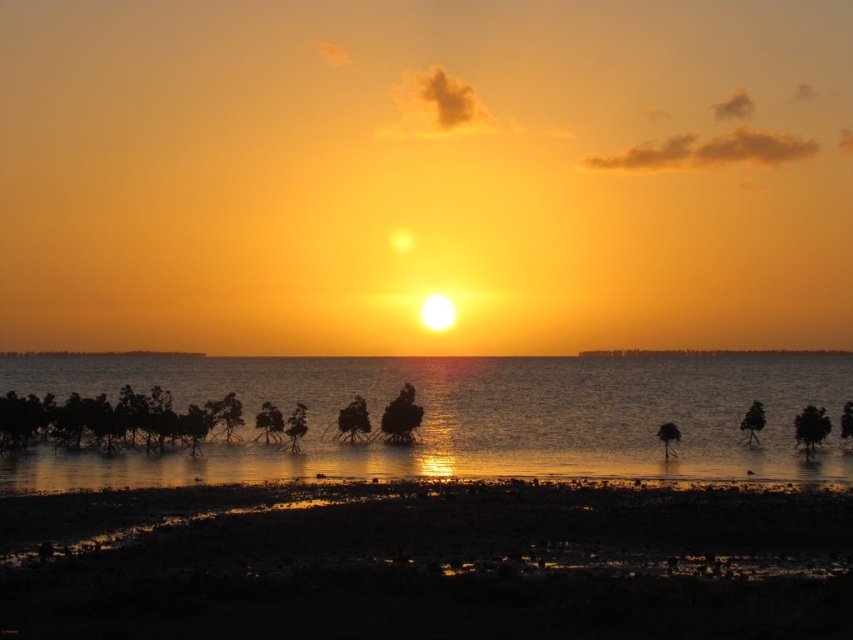
You are standing on the damp sand at lower center and want to reach the silvery reflective water at center. Which direction should you move to get there?

The damp sand at lower center is positioned over the silvery reflective water at center, so you should move downward to reach the silvery reflective water at center.

You are a photographer planning to capture the sunset reflection on the water. You notice the damp sand at lower center and the silvery reflective water at center. Which area would provide a larger surface for the sunset reflection?

The silvery reflective water at center occupies more space than the damp sand at lower center, so it would provide a larger surface for the sunset reflection.